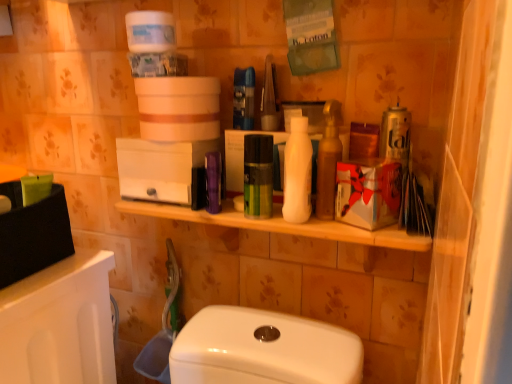
Where is `purple plastic container at center, arranged as the first toiletry when viewed from the left`? The image size is (512, 384). purple plastic container at center, arranged as the first toiletry when viewed from the left is located at coordinates (213, 182).

The image size is (512, 384). I want to click on matte cardboard box at center, so click(x=368, y=193).

Measure the distance between point [256,177] and camera.

Point [256,177] is 73.00 centimeters away from camera.

Identify the location of purple plastic container at center, the second toiletry from the right. The height and width of the screenshot is (384, 512). (213, 182).

Based on the photo, how far apart are white matte bottle at center, which is the 1th toiletry from right to left, and matte cardboard box at center?

white matte bottle at center, which is the 1th toiletry from right to left, is 3.44 inches from matte cardboard box at center.

Is white matte bottle at center, which is counted as the second toiletry, starting from the left, with matte cardboard box at center?

Absolutely, white matte bottle at center, which is counted as the second toiletry, starting from the left, is next to and touching matte cardboard box at center.

Is point (297, 214) farther from camera compared to point (393, 168)?

No, it is not.

Is white matte bottle at center, which is counted as the second toiletry, starting from the left, located outside matte cardboard box at center?

white matte bottle at center, which is counted as the second toiletry, starting from the left, lies outside matte cardboard box at center's area.

Can you confirm if white matte bottle at center, which is the 1th toiletry from right to left, is taller than green matte mouthwash at center?

Yes.

From a real-world perspective, is white matte bottle at center, which is the 1th toiletry from right to left, positioned above or below green matte mouthwash at center?

white matte bottle at center, which is the 1th toiletry from right to left, is situated higher than green matte mouthwash at center in the real world.

Between white matte bottle at center, which is counted as the second toiletry, starting from the left, and green matte mouthwash at center, which one appears on the right side from the viewer's perspective?

Positioned to the right is white matte bottle at center, which is counted as the second toiletry, starting from the left.

Considering the sizes of white matte bottle at center, which is counted as the second toiletry, starting from the left, and green matte mouthwash at center in the image, is white matte bottle at center, which is counted as the second toiletry, starting from the left, bigger or smaller than green matte mouthwash at center?

In the image, white matte bottle at center, which is counted as the second toiletry, starting from the left, appears to be larger than green matte mouthwash at center.

Is white matte bottle at center, which is counted as the second toiletry, starting from the left, turned away from purple plastic container at center, arranged as the first toiletry when viewed from the left?

No, white matte bottle at center, which is counted as the second toiletry, starting from the left, is not facing the opposite direction of purple plastic container at center, arranged as the first toiletry when viewed from the left.

Measure the distance between white matte bottle at center, which is the 1th toiletry from right to left, and purple plastic container at center, the second toiletry from the right.

white matte bottle at center, which is the 1th toiletry from right to left, and purple plastic container at center, the second toiletry from the right, are 6.24 inches apart from each other.

Locate an element on the screen. The height and width of the screenshot is (384, 512). toiletry lying in front of the purple plastic container at center, arranged as the first toiletry when viewed from the left is located at coordinates (297, 173).

Based on the photo, is purple plastic container at center, the second toiletry from the right, completely or partially inside white matte bottle at center, which is the 1th toiletry from right to left?

No, purple plastic container at center, the second toiletry from the right, is not inside white matte bottle at center, which is the 1th toiletry from right to left.

Is point (207, 185) positioned after point (272, 156)?

Yes, point (207, 185) is behind point (272, 156).

Consider the image. Is purple plastic container at center, the second toiletry from the right, taller or shorter than green matte mouthwash at center?

Considering their sizes, purple plastic container at center, the second toiletry from the right, has less height than green matte mouthwash at center.

From the image's perspective, would you say purple plastic container at center, arranged as the first toiletry when viewed from the left, is positioned over green matte mouthwash at center?

Incorrect, from the image's perspective, purple plastic container at center, arranged as the first toiletry when viewed from the left, is lower than green matte mouthwash at center.

How many degrees apart are the facing directions of purple plastic container at center, the second toiletry from the right, and green matte mouthwash at center?

They differ by 0.00782 degrees in their facing directions.

Is matte cardboard box at center positioned with its back to green matte mouthwash at center?

matte cardboard box at center does not have its back to green matte mouthwash at center.

From a real-world perspective, who is located lower, matte cardboard box at center or green matte mouthwash at center?

From a 3D spatial view, matte cardboard box at center is below.

Is matte cardboard box at center in front of or behind green matte mouthwash at center in the image?

In the image, matte cardboard box at center appears in front of green matte mouthwash at center.

Does matte cardboard box at center appear on the right side of green matte mouthwash at center?

Indeed, matte cardboard box at center is positioned on the right side of green matte mouthwash at center.

Which object is positioned more to the right, shiny brown bottle at center or green matte mouthwash at center?

From the viewer's perspective, shiny brown bottle at center appears more on the right side.

Considering the sizes of shiny brown bottle at center and green matte mouthwash at center in the image, is shiny brown bottle at center wider or thinner than green matte mouthwash at center?

In the image, shiny brown bottle at center appears to be wider than green matte mouthwash at center.

Is shiny brown bottle at center smaller than green matte mouthwash at center?

Incorrect, shiny brown bottle at center is not smaller in size than green matte mouthwash at center.

In order to click on mouthwash located on the left of shiny brown bottle at center in this screenshot , I will do `click(258, 176)`.

Which object is thinner, matte cardboard box at center or shiny brown bottle at center?

With smaller width is shiny brown bottle at center.

Which of these two, matte cardboard box at center or shiny brown bottle at center, stands shorter?

With less height is matte cardboard box at center.

Considering the points (375, 192) and (340, 120), which point is in front, point (375, 192) or point (340, 120)?

The point (375, 192) is closer.

How different are the orientations of matte cardboard box at center and shiny brown bottle at center in degrees?

The angular difference between matte cardboard box at center and shiny brown bottle at center is 0.00148 degrees.

At what (x,y) coordinates should I click in order to perform the action: click on the 1st toiletry behind the matte cardboard box at center, starting your count from the anchor. Please return your answer as a coordinate pair (x, y). This screenshot has width=512, height=384. Looking at the image, I should click on (297, 173).

This screenshot has height=384, width=512. I want to click on mouthwash lying on the left of white matte bottle at center, which is counted as the second toiletry, starting from the left, so click(258, 176).

Based on their spatial positions, is matte cardboard box at center or green matte mouthwash at center closer to shiny brown bottle at center?

matte cardboard box at center is closer to shiny brown bottle at center.

Looking at the image, which one is located closer to white matte bottle at center, which is counted as the second toiletry, starting from the left, purple plastic container at center, the second toiletry from the right, or matte cardboard box at center?

Based on the image, matte cardboard box at center appears to be nearer to white matte bottle at center, which is counted as the second toiletry, starting from the left.

From the image, which object appears to be nearer to white matte bottle at center, which is the 1th toiletry from right to left, matte cardboard box at center or purple plastic container at center, arranged as the first toiletry when viewed from the left?

The object closer to white matte bottle at center, which is the 1th toiletry from right to left, is matte cardboard box at center.

Looking at the image, which one is located further to matte cardboard box at center, shiny brown bottle at center or purple plastic container at center, arranged as the first toiletry when viewed from the left?

The object further to matte cardboard box at center is purple plastic container at center, arranged as the first toiletry when viewed from the left.

Which object lies further to the anchor point shiny brown bottle at center, green matte mouthwash at center or matte cardboard box at center?

green matte mouthwash at center is positioned further to the anchor shiny brown bottle at center.

Considering their positions, is white matte bottle at center, which is counted as the second toiletry, starting from the left, positioned further to purple plastic container at center, arranged as the first toiletry when viewed from the left, than shiny brown bottle at center?

shiny brown bottle at center lies further to purple plastic container at center, arranged as the first toiletry when viewed from the left, than the other object.

Which object lies nearer to the anchor point green matte mouthwash at center, matte cardboard box at center or white matte bottle at center, which is the 1th toiletry from right to left?

Among the two, white matte bottle at center, which is the 1th toiletry from right to left, is located nearer to green matte mouthwash at center.

From the image, which object appears to be farther from green matte mouthwash at center, purple plastic container at center, the second toiletry from the right, or shiny brown bottle at center?

The object further to green matte mouthwash at center is shiny brown bottle at center.

Image resolution: width=512 pixels, height=384 pixels. I want to click on toiletry located between purple plastic container at center, arranged as the first toiletry when viewed from the left, and shiny brown bottle at center in the left-right direction, so click(297, 173).

Identify the location of toiletry between purple plastic container at center, arranged as the first toiletry when viewed from the left, and matte cardboard box at center from left to right. (297, 173).

Locate an element on the screen. The image size is (512, 384). cleaning product located between purple plastic container at center, the second toiletry from the right, and matte cardboard box at center in the left-right direction is located at coordinates (328, 161).

You are a GUI agent. You are given a task and a screenshot of the screen. Output one action in this format:
    pyautogui.click(x=<x>, y=<y>)
    Task: Click on the cleaning product between white matte bottle at center, which is the 1th toiletry from right to left, and matte cardboard box at center from left to right
    
    Given the screenshot: What is the action you would take?
    pyautogui.click(x=328, y=161)